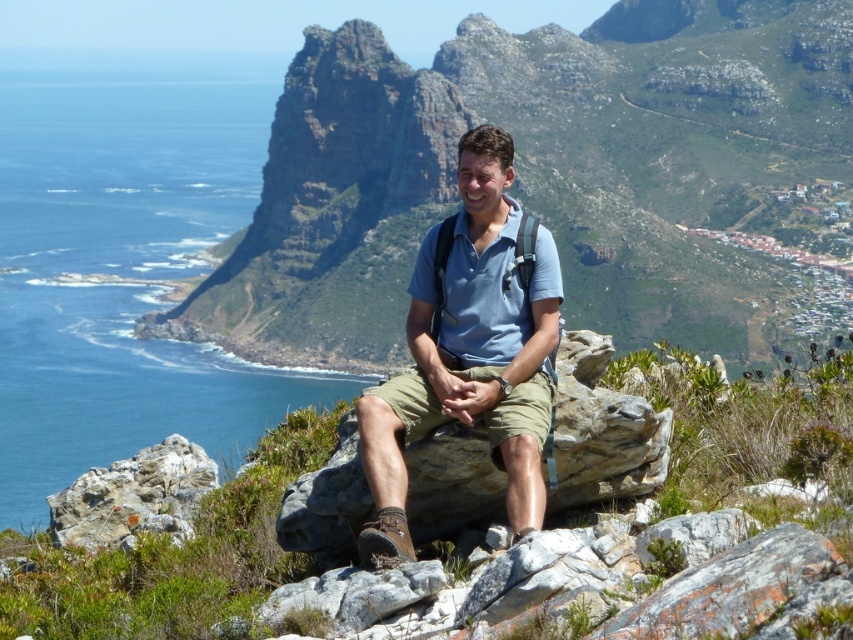
Question: Which object is farther from the camera taking this photo?

Choices:
 (A) blue water at left
 (B) rugged rock formation at center

Answer: (B)

Question: Is blue water at left above blue cotton shirt at center?

Choices:
 (A) yes
 (B) no

Answer: (A)

Question: Which object is positioned closest to the blue water at left?

Choices:
 (A) rugged rock formation at center
 (B) blue cotton shirt at center
 (C) rough textured rock at lower left

Answer: (A)

Question: Can you confirm if rugged rock formation at center is wider than rough textured rock at lower left?

Choices:
 (A) no
 (B) yes

Answer: (B)

Question: Which of these objects is positioned closest to the rugged rock formation at center?

Choices:
 (A) rough textured rock at lower left
 (B) blue water at left

Answer: (B)

Question: Can you confirm if blue water at left is positioned below rough textured rock at lower left?

Choices:
 (A) yes
 (B) no

Answer: (B)